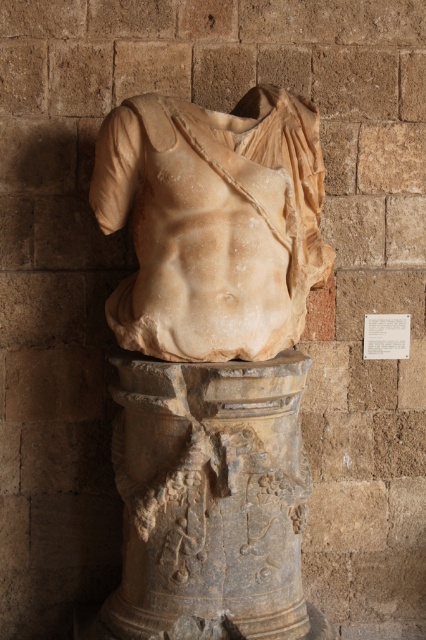
Question: Estimate the real-world distances between objects in this image. Which object is closer to the gray stone pedestal at center?

Choices:
 (A) marble statue torso at center
 (B) marble statue at center

Answer: (B)

Question: Which point appears farthest from the camera in this image?

Choices:
 (A) (181, 336)
 (B) (281, 552)

Answer: (B)

Question: Is marble statue torso at center wider than gray stone pedestal at center?

Choices:
 (A) yes
 (B) no

Answer: (A)

Question: Can you confirm if marble statue at center is smaller than gray stone pedestal at center?

Choices:
 (A) no
 (B) yes

Answer: (A)

Question: Is marble statue torso at center below gray stone pedestal at center?

Choices:
 (A) no
 (B) yes

Answer: (A)

Question: Which of the following is the farthest from the observer?

Choices:
 (A) (314, 243)
 (B) (190, 636)
 (C) (94, 168)

Answer: (C)